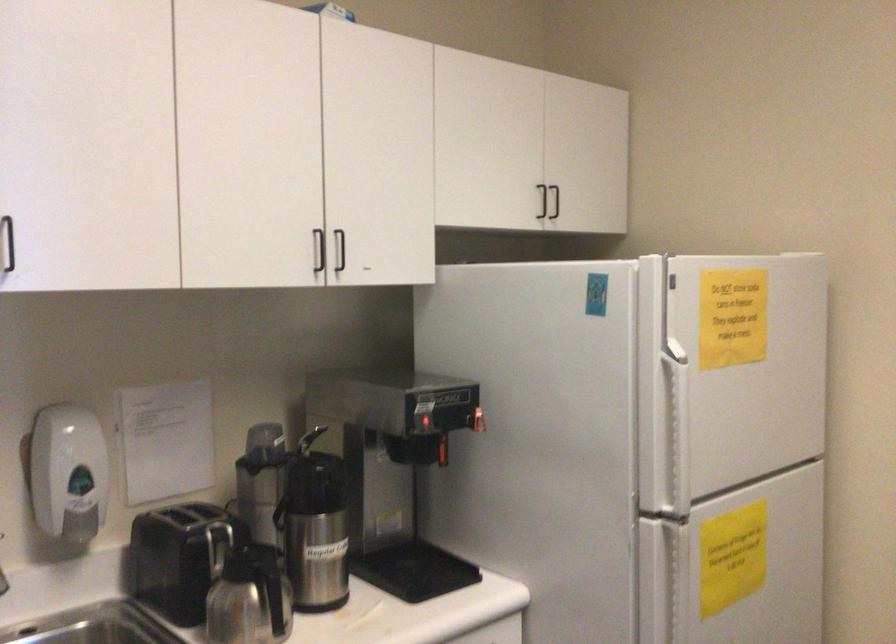
Describe the element at coordinates (67, 473) in the screenshot. I see `the soap dispenser lever` at that location.